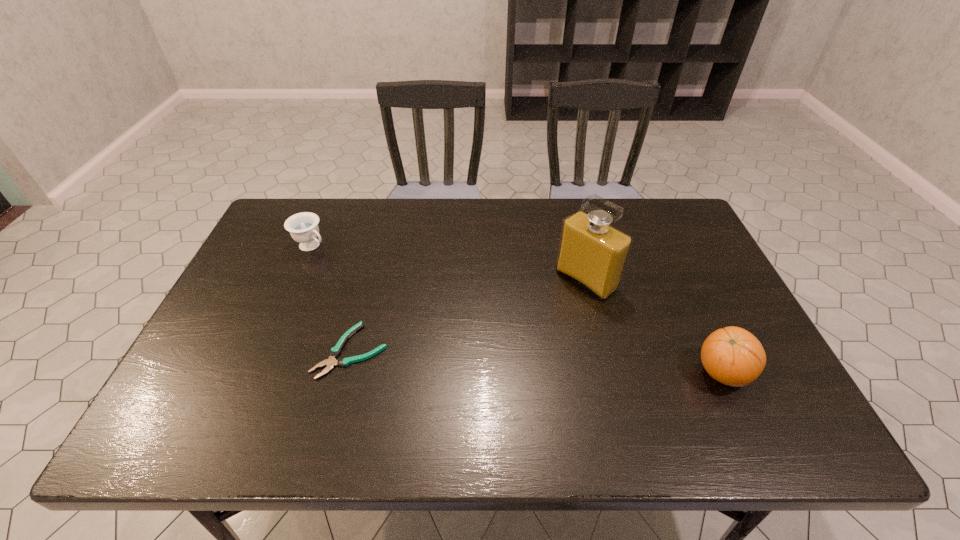
What are the coordinates of `object that is at the right edge` in the screenshot? It's located at (733, 356).

Locate an element on the screen. This screenshot has width=960, height=540. object at the far left corner is located at coordinates (303, 227).

Locate an element on the screen. This screenshot has height=540, width=960. object that is at the near right corner is located at coordinates (733, 356).

The width and height of the screenshot is (960, 540). I want to click on vacant position at the far edge of the desktop, so click(479, 227).

Where is `free location at the near edge`? This screenshot has height=540, width=960. free location at the near edge is located at coordinates click(556, 390).

Find the location of `vacant region at the left edge of the desktop`. vacant region at the left edge of the desktop is located at coordinates (249, 352).

Where is `vacant space at the right edge`? This screenshot has width=960, height=540. vacant space at the right edge is located at coordinates (685, 249).

In the image, there is a desktop. Where is `vacant space at the near right corner`? vacant space at the near right corner is located at coordinates (714, 382).

The height and width of the screenshot is (540, 960). I want to click on unoccupied area between the perfume and the third shortest object, so [655, 327].

This screenshot has width=960, height=540. I want to click on vacant area that lies between the perfume and the third shortest object, so click(x=655, y=327).